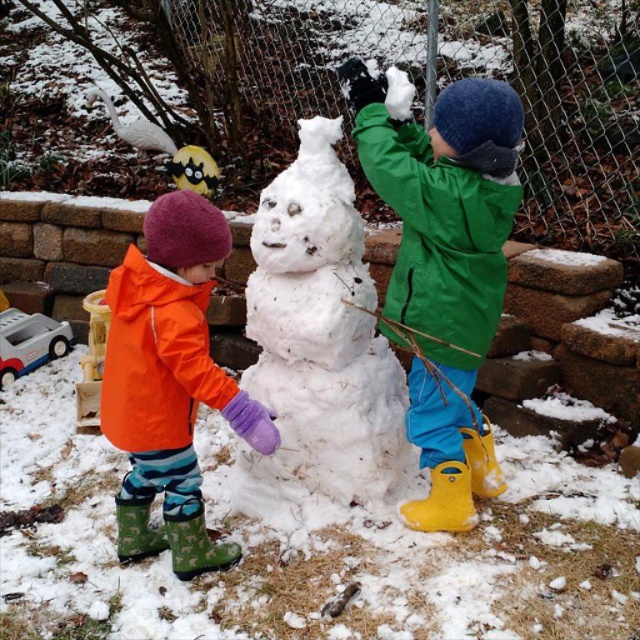
Who is higher up, white fluffy snowman at center or orange waterproof jacket at center?

Positioned higher is white fluffy snowman at center.

In the scene shown: Is white fluffy snowman at center shorter than orange waterproof jacket at center?

Incorrect, white fluffy snowman at center's height does not fall short of orange waterproof jacket at center's.

Identify the location of white fluffy snowman at center. (321, 339).